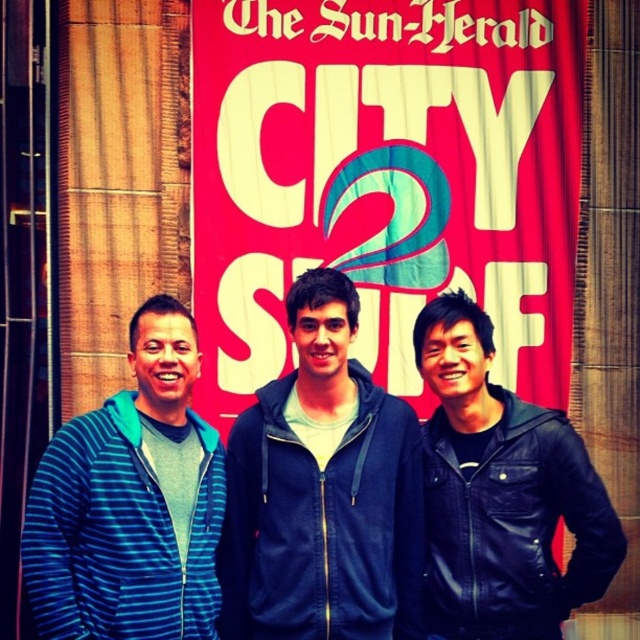
You are a photographer trying to capture a photo of the dark blue hoodie at center and the blue striped hoodie at left. Based on the scene, which hoodie is positioned higher in the frame?

The dark blue hoodie at center is positioned higher in the frame than the blue striped hoodie at left.